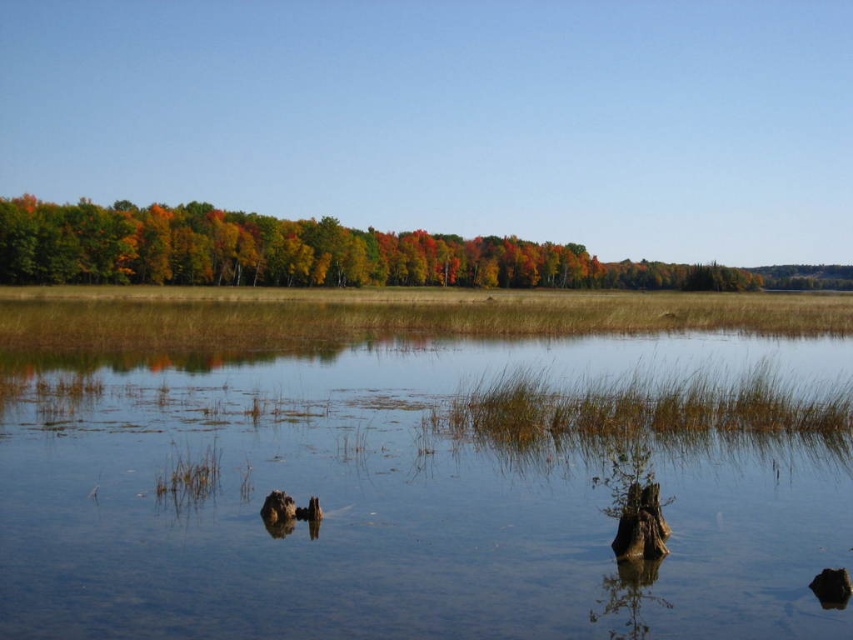
Can you confirm if clear water at center is shorter than multicolored foliage at center?

Yes, clear water at center is shorter than multicolored foliage at center.

Consider the image. Who is more forward, (x=126, y=518) or (x=366, y=252)?

Point (x=126, y=518) is in front.

Is point (844, 522) more distant than point (543, 264)?

No, (844, 522) is in front of (543, 264).

Locate an element on the screen. This screenshot has width=853, height=640. clear water at center is located at coordinates (405, 500).